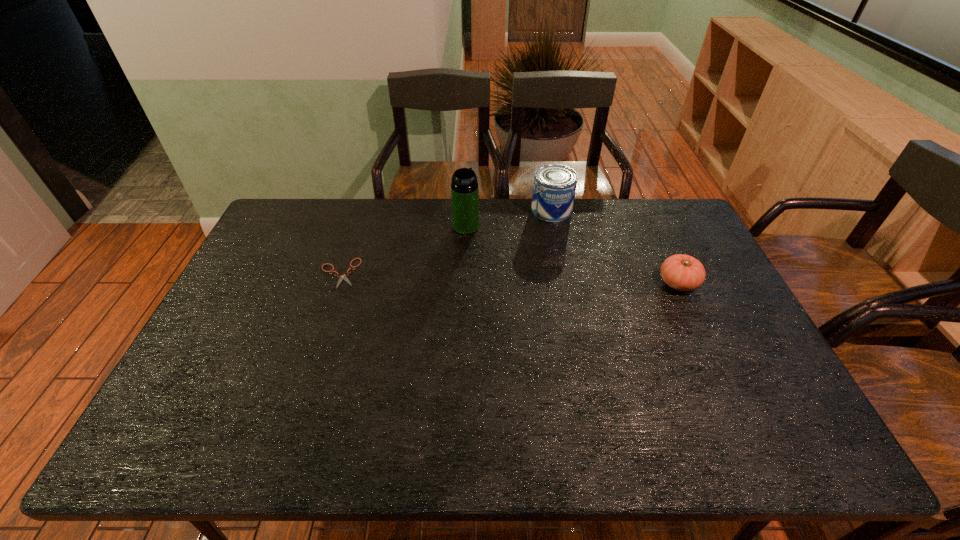
I want to click on free space between the tallest object and the tomato, so tap(572, 255).

Where is `unoccupied position between the shortest object and the third shortest object`? The image size is (960, 540). unoccupied position between the shortest object and the third shortest object is located at coordinates (445, 241).

Image resolution: width=960 pixels, height=540 pixels. What are the coordinates of `vacant region between the shortest object and the third object from left to right` in the screenshot? It's located at (445, 241).

At what (x,y) coordinates should I click in order to perform the action: click on vacant space that's between the shortest object and the second object from right to left. Please return your answer as a coordinate pair (x, y). This screenshot has height=540, width=960. Looking at the image, I should click on (445, 241).

You are a GUI agent. You are given a task and a screenshot of the screen. Output one action in this format:
    pyautogui.click(x=<x>, y=<y>)
    Task: Click on the object that stands as the closest to the shears
    The height and width of the screenshot is (540, 960).
    Given the screenshot: What is the action you would take?
    pyautogui.click(x=464, y=187)

In order to click on object that is the second closest to the second shortest object in this screenshot , I will do `click(464, 187)`.

I want to click on free space in the image that satisfies the following two spatial constraints: 1. on the back side of the third object from right to left; 2. on the left side of the shears, so click(x=355, y=226).